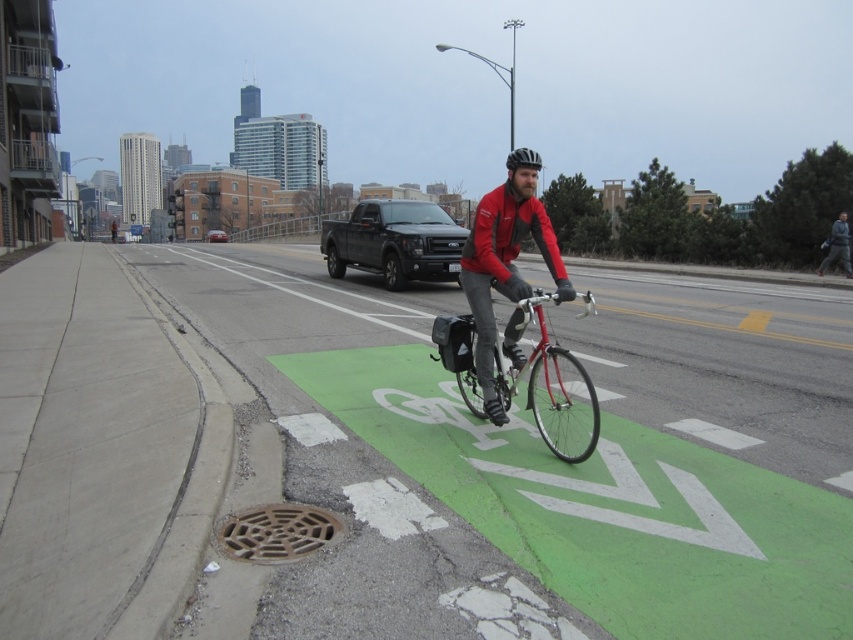
How far apart are matte black truck at center and metallic silver truck at center?

matte black truck at center is 61.09 meters away from metallic silver truck at center.

Does matte black truck at center appear over metallic silver truck at center?

No, matte black truck at center is not above metallic silver truck at center.

Is point (407, 236) in front of point (207, 232)?

That is True.

In order to click on matte black truck at center in this screenshot , I will do `click(395, 241)`.

Between shiny metallic bicycle at center and dark gray jacket at upper right, which one is positioned higher?

dark gray jacket at upper right is higher up.

Who is taller, shiny metallic bicycle at center or dark gray jacket at upper right?

With more height is dark gray jacket at upper right.

Who is more distant from viewer, (595, 428) or (840, 236)?

The point (840, 236) is behind.

Locate an element on the screen. shiny metallic bicycle at center is located at coordinates (556, 380).

Can you confirm if dark gray jacket at upper right is positioned to the left of metallic silver truck at center?

No, dark gray jacket at upper right is not to the left of metallic silver truck at center.

Which is above, dark gray jacket at upper right or metallic silver truck at center?

metallic silver truck at center

Image resolution: width=853 pixels, height=640 pixels. What are the coordinates of `dark gray jacket at upper right` in the screenshot? It's located at (837, 244).

At what (x,y) coordinates should I click in order to perform the action: click on dark gray jacket at upper right. Please return your answer as a coordinate pair (x, y). This screenshot has width=853, height=640. Looking at the image, I should click on click(837, 244).